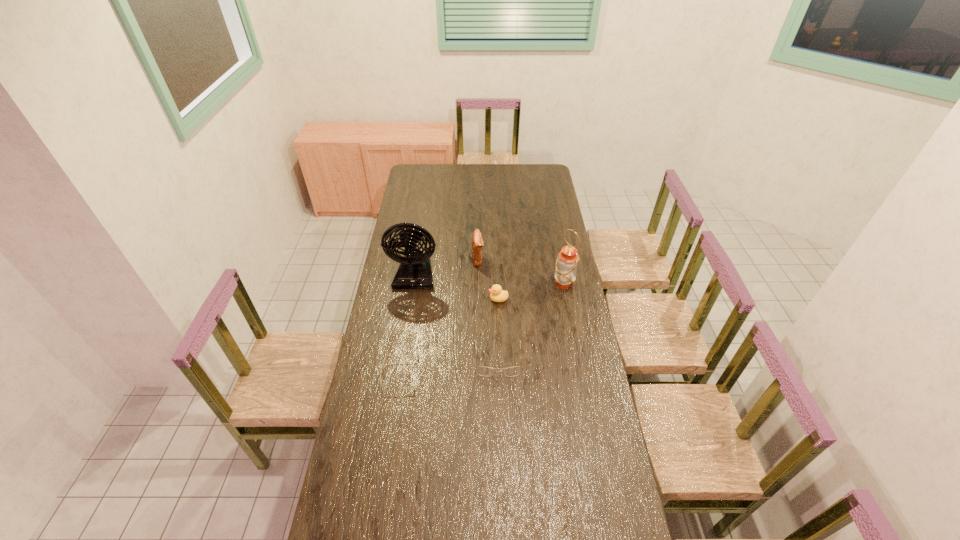
This screenshot has height=540, width=960. Identify the location of the shorter spectacles. (386, 357).

Locate an element on the screen. the shortest object is located at coordinates (386, 357).

Find the location of a particular element. the taller spectacles is located at coordinates tap(480, 370).

Identify the location of the second shortest object. (480, 370).

Locate an element on the screen. Image resolution: width=960 pixels, height=540 pixels. fan is located at coordinates (414, 272).

Where is `clutch bag`? This screenshot has width=960, height=540. clutch bag is located at coordinates [477, 242].

Locate an element on the screen. the rightmost object is located at coordinates (567, 260).

At what (x,y) coordinates should I click in order to perform the action: click on the third shortest object. Please return your answer as a coordinate pair (x, y). Image resolution: width=960 pixels, height=540 pixels. Looking at the image, I should click on (497, 294).

Where is `the fourth farthest object`? This screenshot has width=960, height=540. the fourth farthest object is located at coordinates (497, 294).

Identify the location of free space located on the front-facing side of the right spectacles. (501, 438).